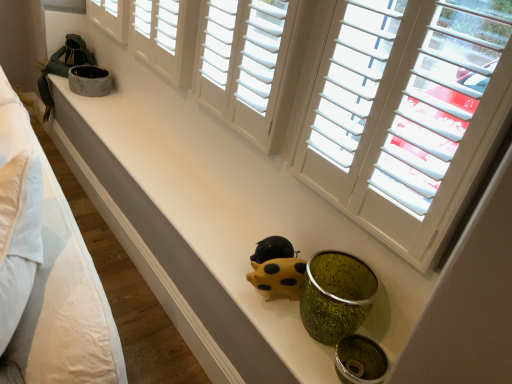
Locate an element on the screen. Image resolution: width=512 pixels, height=384 pixels. free space to the left of yellow matte piggy bank at center is located at coordinates (228, 269).